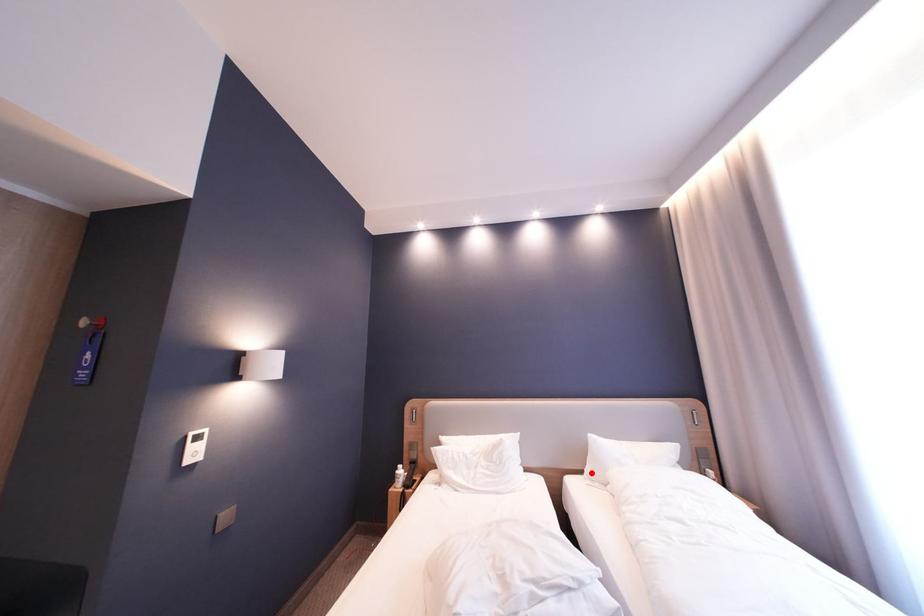
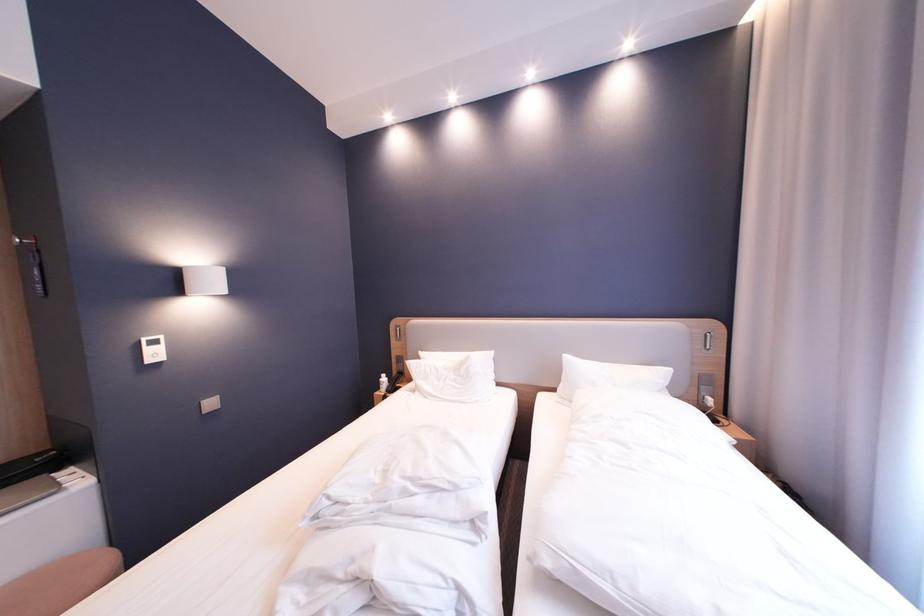
Find the pixel in the second image that matches the highlighted location in the first image.

(565, 391)